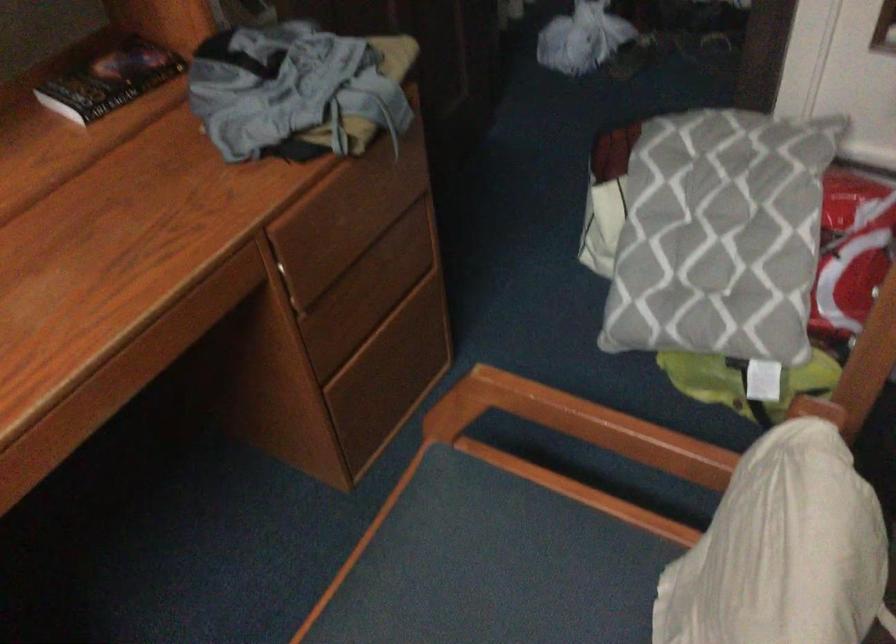
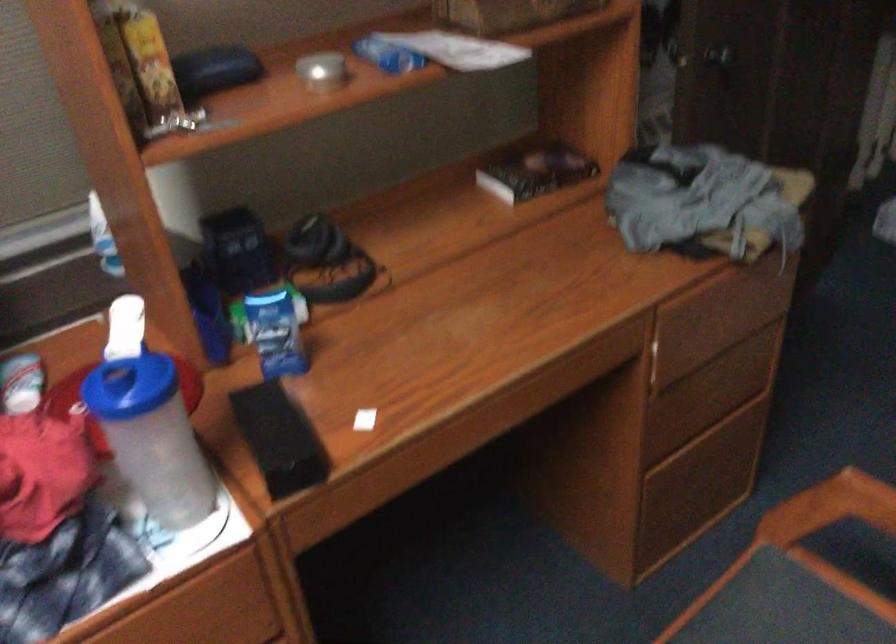
Find the pixel in the second image that matches point (478, 404) in the first image.

(830, 507)